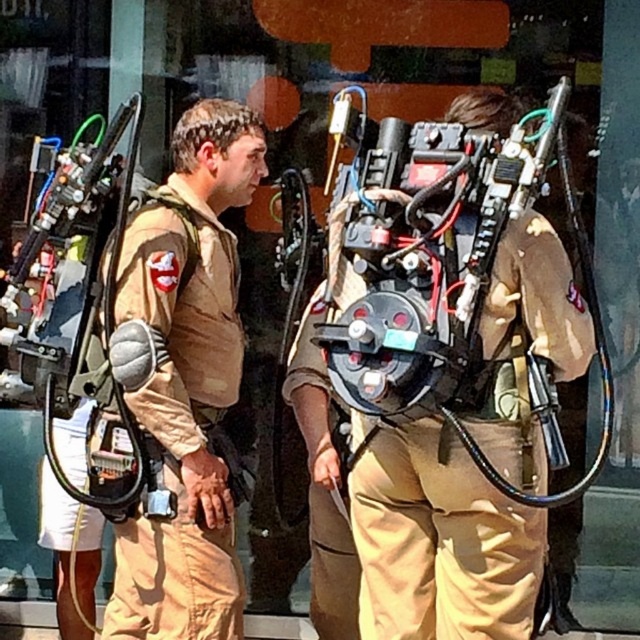
Question: Among these objects, which one is nearest to the camera?

Choices:
 (A) tan fabric uniform at center
 (B) matte black backpack at center

Answer: (B)

Question: Is tan fabric uniform at center bigger than matte black backpack at center?

Choices:
 (A) yes
 (B) no

Answer: (A)

Question: Observing the image, what is the correct spatial positioning of tan fabric uniform at center in reference to matte black backpack at center?

Choices:
 (A) above
 (B) below

Answer: (A)

Question: Which object appears farthest from the camera in this image?

Choices:
 (A) tan fabric uniform at center
 (B) matte black backpack at center

Answer: (A)

Question: Can you confirm if tan fabric uniform at center is positioned to the left of matte black backpack at center?

Choices:
 (A) yes
 (B) no

Answer: (A)